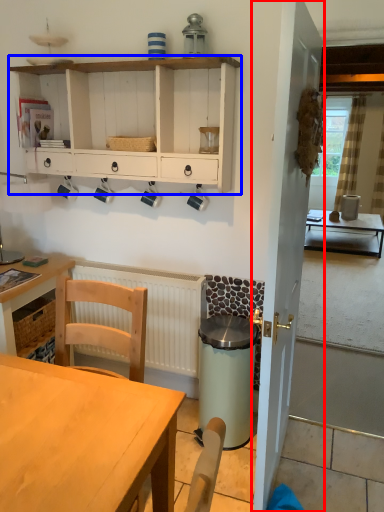
Question: Which of the following is the farthest to the observer, door (highlighted by a red box) or cabinetry (highlighted by a blue box)?

Choices:
 (A) door
 (B) cabinetry

Answer: (B)